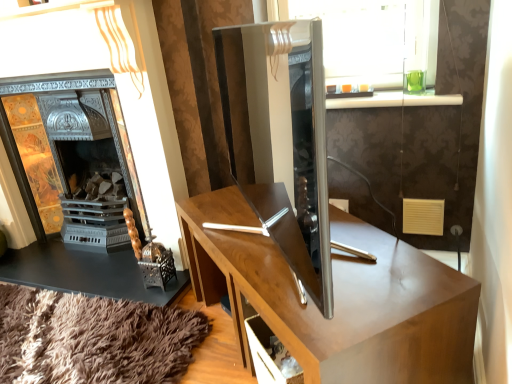
Question: Visually, is wooden desk at center positioned to the left or to the right of metallic silver fireplace at left?

Choices:
 (A) left
 (B) right

Answer: (B)

Question: Is wooden desk at center bigger or smaller than metallic silver fireplace at left?

Choices:
 (A) big
 (B) small

Answer: (B)

Question: From a real-world perspective, is wooden desk at center above or below metallic silver fireplace at left?

Choices:
 (A) above
 (B) below

Answer: (B)

Question: Is metallic silver fireplace at left taller or shorter than wooden desk at center?

Choices:
 (A) short
 (B) tall

Answer: (B)

Question: Is metallic silver fireplace at left inside or outside of wooden desk at center?

Choices:
 (A) outside
 (B) inside

Answer: (A)

Question: From the image's perspective, relative to wooden desk at center, is metallic silver fireplace at left above or below?

Choices:
 (A) below
 (B) above

Answer: (B)

Question: Based on their sizes in the image, would you say metallic silver fireplace at left is bigger or smaller than wooden desk at center?

Choices:
 (A) small
 (B) big

Answer: (B)